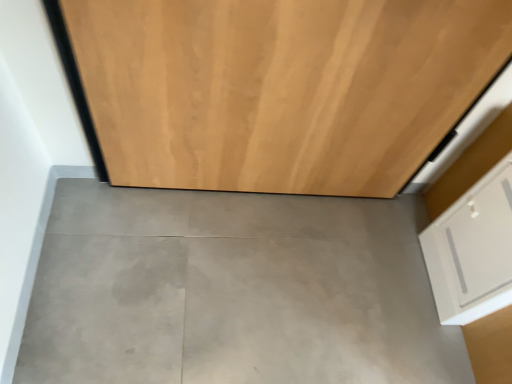
Find the location of `spots to the right of wooden door at center`. spots to the right of wooden door at center is located at coordinates (359, 259).